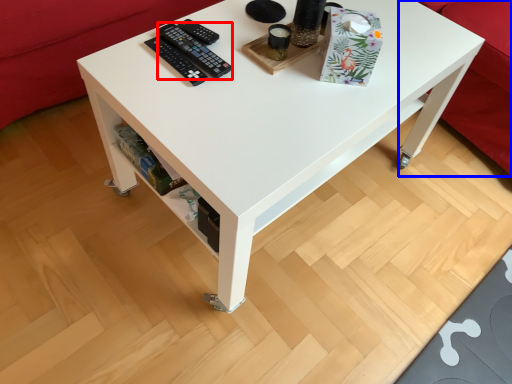
Question: Which point is further to the camera, control (highlighted by a red box) or couch (highlighted by a blue box)?

Choices:
 (A) control
 (B) couch

Answer: (B)